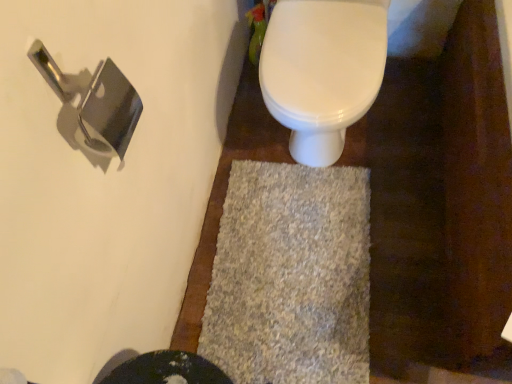
I want to click on vacant space in front of white glossy toilet at upper center, so click(x=405, y=216).